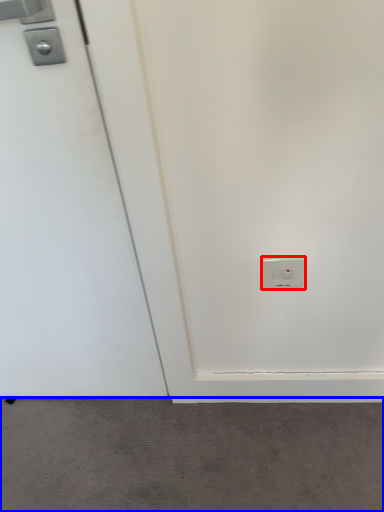
Question: Which of the following is the closest to the observer, power plugs and sockets (highlighted by a red box) or concrete (highlighted by a blue box)?

Choices:
 (A) power plugs and sockets
 (B) concrete

Answer: (A)